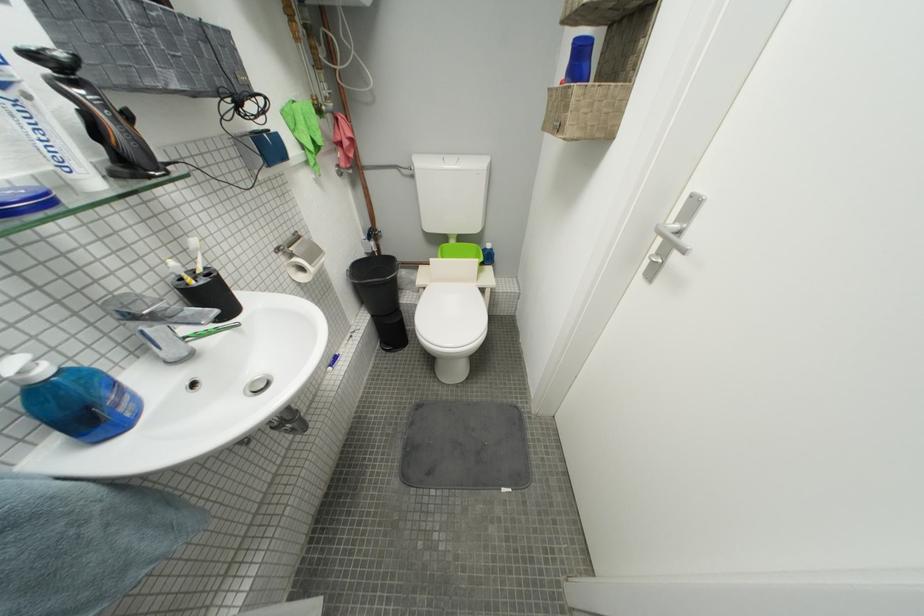
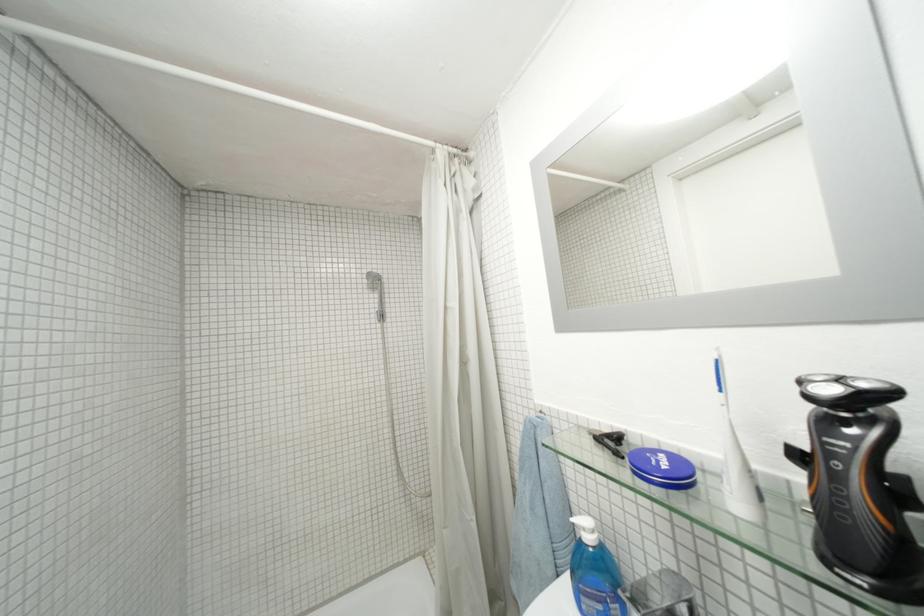
In the second image, find the point that corresponds to the point at 53,374 in the first image.

(598, 541)